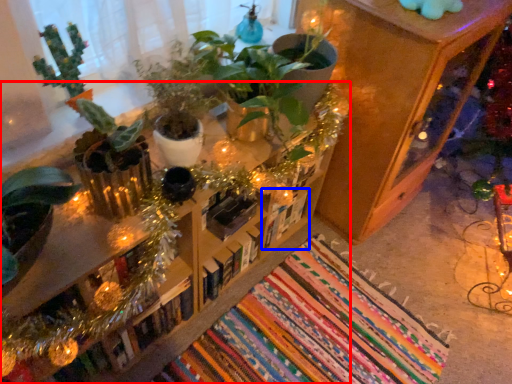
Question: Which point is closer to the camera, furniture (highlighted by a red box) or book (highlighted by a blue box)?

Choices:
 (A) furniture
 (B) book

Answer: (A)